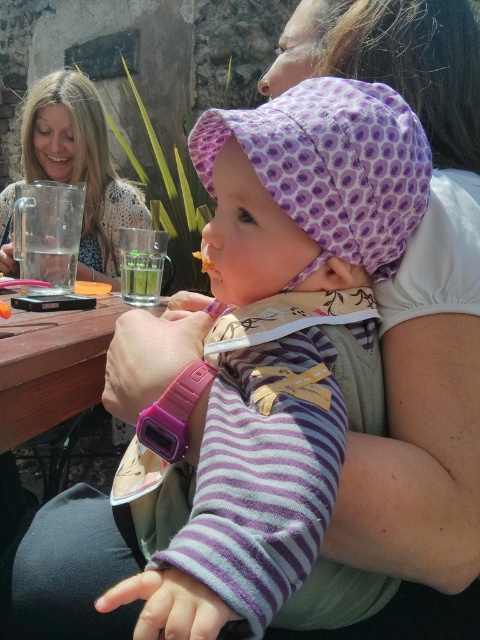
Based on the scene, where is the blonde hair at upper left located in the image?

The blonde hair at upper left is located at point (81, 166) in the image.

Consider the image. You are a food delivery person who needs to place a hot meal between the green leafy vegetable at center and the yellow crumbly food at center. The meal requires at least 30 inches of space to fit. Can you place it there?

The distance between the green leafy vegetable at center and the yellow crumbly food at center is 35.36 inches, which is more than the required 30 inches. Therefore, you can place the hot meal there.